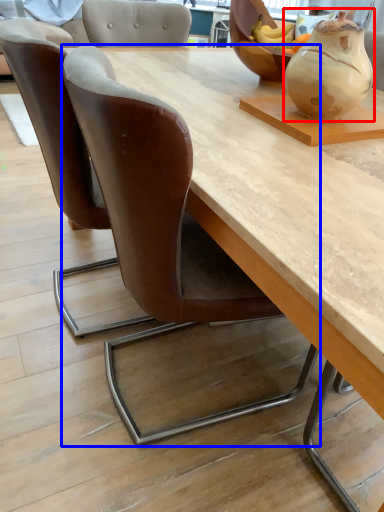
Question: Which object is closer to the camera taking this photo, vase (highlighted by a red box) or chair (highlighted by a blue box)?

Choices:
 (A) vase
 (B) chair

Answer: (B)